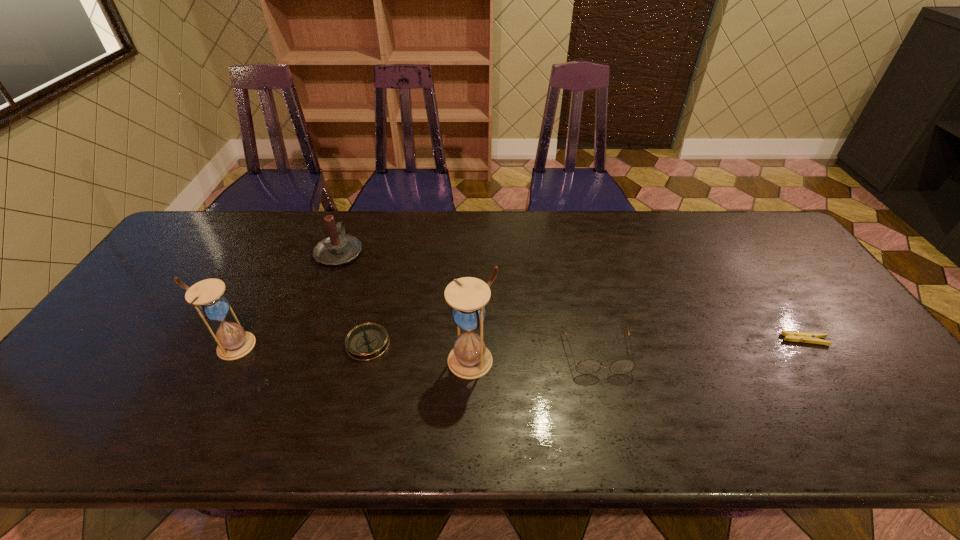
Image resolution: width=960 pixels, height=540 pixels. Identify the location of hourglass situated at the near edge. (469, 359).

Where is `spectacles located in the near edge section of the desktop`? Image resolution: width=960 pixels, height=540 pixels. spectacles located in the near edge section of the desktop is located at coordinates (590, 366).

This screenshot has width=960, height=540. Identify the location of object present at the right edge. (806, 337).

Image resolution: width=960 pixels, height=540 pixels. What are the coordinates of `free point at the far edge` in the screenshot? It's located at (394, 229).

I want to click on vacant space at the near edge of the desktop, so click(274, 378).

Image resolution: width=960 pixels, height=540 pixels. I want to click on vacant area at the left edge of the desktop, so pyautogui.click(x=136, y=295).

You are a GUI agent. You are given a task and a screenshot of the screen. Output one action in this format:
    pyautogui.click(x=<x>, y=<y>)
    Task: Click on the free spot at the right edge of the desktop
    This screenshot has width=960, height=540.
    Given the screenshot: What is the action you would take?
    pyautogui.click(x=821, y=325)

In the image, there is a desktop. At what (x,y) coordinates should I click in order to perform the action: click on free region at the far left corner. Please return your answer as a coordinate pair (x, y). Image resolution: width=960 pixels, height=540 pixels. Looking at the image, I should click on (210, 221).

In order to click on vacant space at the far right corner of the desktop in this screenshot , I will do `click(765, 251)`.

Find the location of a particular element. Image resolution: width=960 pixels, height=540 pixels. vacant area that lies between the right hourglass and the farthest object is located at coordinates (406, 306).